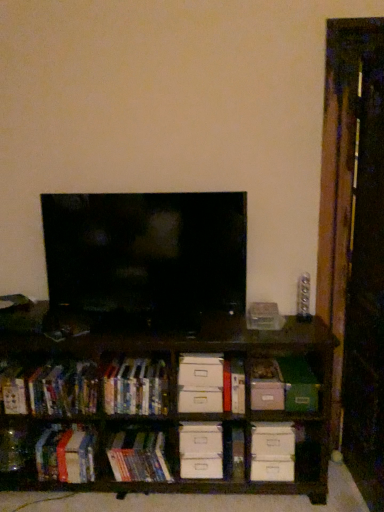
What do you see at coordinates (354, 243) in the screenshot? This screenshot has width=384, height=512. I see `transparent glass door at right` at bounding box center [354, 243].

You are a GUI agent. You are given a task and a screenshot of the screen. Output one action in this format:
    pyautogui.click(x=<x>, y=<y>)
    Task: Click on the hardcover book at lower left, the 5th book from the right
    
    Given the screenshot: What is the action you would take?
    pyautogui.click(x=14, y=391)

What do you see at coordinates (14, 391) in the screenshot?
I see `hardcover book at lower left, the 5th book from the right` at bounding box center [14, 391].

Describe the element at coordinates (200, 383) in the screenshot. I see `white cardboard drawer at center, the 2th drawer from the bottom` at that location.

Identify the location of hardcover books at center, which ranks as the 5th book in left-to-right order. (138, 457).

What are the coordinates of `hardcover books at center, which appears as the second book when viewed from the right` in the screenshot? It's located at (136, 387).

How much space does white cardboard drawer at center, which is the first drawer in bottom-to-top order, occupy horizontally?

The width of white cardboard drawer at center, which is the first drawer in bottom-to-top order, is 4.79 inches.

Locate an element on the screen. The image size is (384, 512). transparent glass door at right is located at coordinates (354, 243).

Is hardcover books at center, the fourth book when ordered from left to right, taller or shorter than matte black tv at center?

Considering their sizes, hardcover books at center, the fourth book when ordered from left to right, has less height than matte black tv at center.

Which is more to the right, hardcover books at center, which appears as the second book when viewed from the right, or matte black tv at center?

matte black tv at center.

Is hardcover books at center, which appears as the second book when viewed from the right, wider than matte black tv at center?

Correct, the width of hardcover books at center, which appears as the second book when viewed from the right, exceeds that of matte black tv at center.

Based on the photo, could you tell me if hardcover books at center, which appears as the second book when viewed from the right, is turned towards matte black tv at center?

No, hardcover books at center, which appears as the second book when viewed from the right, is not turned towards matte black tv at center.

Can you confirm if white cardboard drawer at center, which is the first drawer in bottom-to-top order, is positioned to the left of hardcover book at lower left, which appears as the fourth book when viewed from the right?

No.

Can you confirm if white cardboard drawer at center, which is the first drawer in bottom-to-top order, is shorter than hardcover book at lower left, the 2th book from the left?

Correct, white cardboard drawer at center, which is the first drawer in bottom-to-top order, is not as tall as hardcover book at lower left, the 2th book from the left.

How many degrees apart are the facing directions of white cardboard drawer at center, which is the first drawer in bottom-to-top order, and hardcover book at lower left, the 2th book from the left?

The angular difference between white cardboard drawer at center, which is the first drawer in bottom-to-top order, and hardcover book at lower left, the 2th book from the left, is 5.53 degrees.

Considering the sizes of objects matte black tv at center and hardcover books at center, which ranks as the 5th book in left-to-right order, in the image provided, who is shorter, matte black tv at center or hardcover books at center, which ranks as the 5th book in left-to-right order,?

With less height is hardcover books at center, which ranks as the 5th book in left-to-right order.

From the image's perspective, which book is the 5th one below the matte black tv at center? Please provide its 2D coordinates.

[(138, 457)]

Does point (171, 238) lie behind point (158, 442)?

No, it is in front of (158, 442).

Is matte black tv at center not inside hardcover books at center, which ranks as the 5th book in left-to-right order?

Yes, matte black tv at center is not within hardcover books at center, which ranks as the 5th book in left-to-right order.

Is transparent glass door at right not near matte black tv at center?

transparent glass door at right is near matte black tv at center, not far away.

In the scene shown: Is matte black tv at center located within transparent glass door at right?

No, matte black tv at center is not surrounded by transparent glass door at right.

Does point (332, 188) come closer to viewer compared to point (88, 279)?

No, (332, 188) is further to viewer.

Is hardcover book at lower left, arranged as the first book when viewed from the left, outside of white cardboard drawer at center, which is the first drawer in bottom-to-top order?

Yes.

Considering the relative positions of hardcover book at lower left, the 5th book from the right, and white cardboard drawer at center, which is the first drawer in bottom-to-top order, in the image provided, is hardcover book at lower left, the 5th book from the right, to the left or to the right of white cardboard drawer at center, which is the first drawer in bottom-to-top order,?

hardcover book at lower left, the 5th book from the right, is to the left of white cardboard drawer at center, which is the first drawer in bottom-to-top order.

From the image's perspective, which one is positioned higher, hardcover book at lower left, the 5th book from the right, or white cardboard drawer at center, which is the 2th drawer from top to bottom?

hardcover book at lower left, the 5th book from the right, from the image's perspective.

Which book is the 2nd one when counting from the front of the hardcover book at lower left, the 2th book from the left? Please provide its 2D coordinates.

[(14, 391)]

Does hardcover book at lower left, which appears as the fourth book when viewed from the right, appear on the right side of hardcover book at lower left, the 5th book from the right?

Correct, you'll find hardcover book at lower left, which appears as the fourth book when viewed from the right, to the right of hardcover book at lower left, the 5th book from the right.

Is hardcover book at lower left, which appears as the fourth book when viewed from the right, facing away from hardcover book at lower left, arranged as the first book when viewed from the left?

No, hardcover book at lower left, arranged as the first book when viewed from the left, is not at the back of hardcover book at lower left, which appears as the fourth book when viewed from the right.

From the image's perspective, is hardcover book at lower left, which appears as the fourth book when viewed from the right, located above or below hardcover book at lower left, arranged as the first book when viewed from the left?

Based on their image positions, hardcover book at lower left, which appears as the fourth book when viewed from the right, is located beneath hardcover book at lower left, arranged as the first book when viewed from the left.

Can you confirm if hardcover books at center, the fourth book when ordered from left to right, is wider than brown wooden shelf at center?

Incorrect, the width of hardcover books at center, the fourth book when ordered from left to right, does not surpass that of brown wooden shelf at center.

In the scene shown: Is hardcover books at center, which appears as the second book when viewed from the right, turned away from brown wooden shelf at center?

Yes, brown wooden shelf at center is at the back of hardcover books at center, which appears as the second book when viewed from the right.

Locate an element on the screen. The height and width of the screenshot is (512, 384). shelf in front of the hardcover books at center, the fourth book when ordered from left to right is located at coordinates (144, 398).

From the picture: Is hardcover books at center, the fourth book when ordered from left to right, positioned before brown wooden shelf at center?

No, hardcover books at center, the fourth book when ordered from left to right, is further to the viewer.

At what (x,y) coordinates should I click in order to perform the action: click on television on the right of hardcover books at center, the fourth book when ordered from left to right. Please return your answer as a coordinate pair (x, y). The image size is (384, 512). Looking at the image, I should click on (146, 257).

At what (x,y) coordinates should I click in order to perform the action: click on drawer that appears behind the hardcover book at lower left, the 2th book from the left. Please return your answer as a coordinate pair (x, y). This screenshot has height=512, width=384. Looking at the image, I should click on (201, 450).

From the picture: Considering their positions, is hardcover book at lower left, the 5th book from the right, positioned closer to white cardboard drawer at center, which is the 1th drawer in top-to-bottom order, than transparent glass door at right?

The object closer to white cardboard drawer at center, which is the 1th drawer in top-to-bottom order, is transparent glass door at right.

When comparing their distances from white cardboard drawer at center, which is the 1th drawer in top-to-bottom order, does hardcover book at lower left, which appears as the fourth book when viewed from the right, or hardcover book at lower left, arranged as the first book when viewed from the left, seem further?

Based on the image, hardcover book at lower left, arranged as the first book when viewed from the left, appears to be further to white cardboard drawer at center, which is the 1th drawer in top-to-bottom order.

Based on their spatial positions, is white cardboard drawer at center, which is the 1th drawer in top-to-bottom order, or hardcover books at left, which is counted as the 3th book, starting from the right, closer to white cardboard drawer at center, which is the 2th drawer from top to bottom?

white cardboard drawer at center, which is the 1th drawer in top-to-bottom order.

From the image, which object appears to be nearer to hardcover book at lower left, the 2th book from the left, hardcover book at lower left, the 5th book from the right, or transparent glass door at right?

Among the two, hardcover book at lower left, the 5th book from the right, is located nearer to hardcover book at lower left, the 2th book from the left.

Estimate the real-world distances between objects in this image. Which object is closer to white cardboard drawer at center, which is the first drawer in bottom-to-top order, hardcover books at center, the fourth book when ordered from left to right, or green matte paper at center-right?

Based on the image, hardcover books at center, the fourth book when ordered from left to right, appears to be nearer to white cardboard drawer at center, which is the first drawer in bottom-to-top order.

Estimate the real-world distances between objects in this image. Which object is further from transparent glass door at right, green matte paper at center-right or hardcover book at lower left, the 5th book from the right?

Based on the image, hardcover book at lower left, the 5th book from the right, appears to be further to transparent glass door at right.

Which object lies nearer to the anchor point transparent glass door at right, hardcover books at left, which is counted as the 3th book, starting from the right, or hardcover book at lower left, which appears as the fourth book when viewed from the right?

hardcover books at left, which is counted as the 3th book, starting from the right, lies closer to transparent glass door at right than the other object.

Estimate the real-world distances between objects in this image. Which object is further from hardcover book at lower left, arranged as the first book when viewed from the left, white cardboard drawer at center, which is the 1th drawer in top-to-bottom order, or hardcover books at center, the fourth book when ordered from left to right?

white cardboard drawer at center, which is the 1th drawer in top-to-bottom order, is positioned further to the anchor hardcover book at lower left, arranged as the first book when viewed from the left.

Where is `drawer between matte black tv at center and brown wooden shelf at center in the vertical direction`? drawer between matte black tv at center and brown wooden shelf at center in the vertical direction is located at coordinates (200, 383).

You are a GUI agent. You are given a task and a screenshot of the screen. Output one action in this format:
    pyautogui.click(x=<x>, y=<y>)
    Task: Click on the book between hardcover books at center, which appears as the second book when viewed from the right, and transparent glass door at right from left to right
    This screenshot has width=384, height=512.
    Given the screenshot: What is the action you would take?
    pyautogui.click(x=138, y=457)

Where is `drawer located between hardcover book at lower left, arranged as the first book when viewed from the left, and white cardboard drawer at center, which is the 2th drawer from top to bottom, in the left-right direction`? drawer located between hardcover book at lower left, arranged as the first book when viewed from the left, and white cardboard drawer at center, which is the 2th drawer from top to bottom, in the left-right direction is located at coordinates (200, 383).

Image resolution: width=384 pixels, height=512 pixels. In order to click on shelf between matte black tv at center and hardcover books at center, which ranks as the 5th book in left-to-right order, in the up-down direction in this screenshot , I will do `click(144, 398)`.